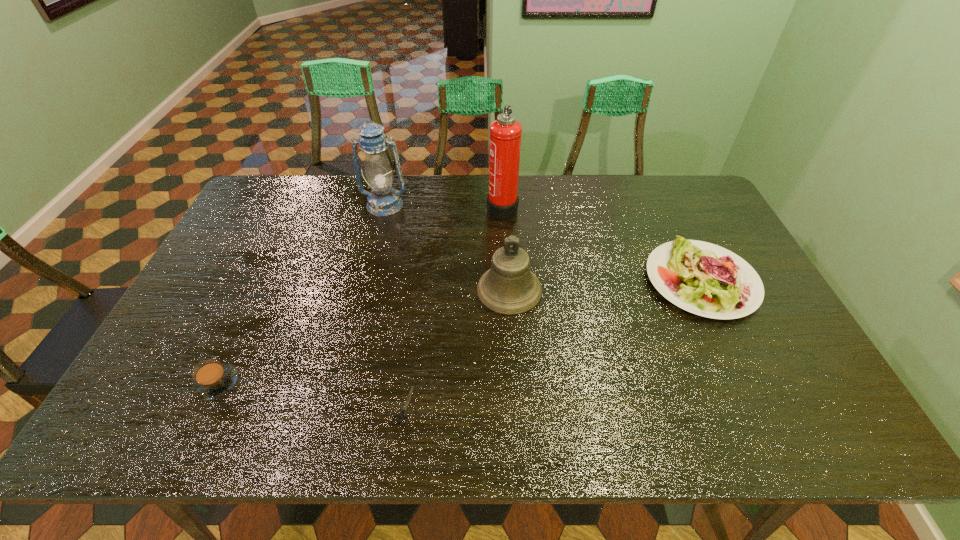
The width and height of the screenshot is (960, 540). In order to click on vacant area situated 0.370m on the front-facing side of the fire extinguisher in this screenshot , I will do `click(378, 206)`.

Identify the location of vacant space located on the front-facing side of the fire extinguisher. This screenshot has width=960, height=540. (396, 206).

This screenshot has height=540, width=960. Find the location of `vacant area situated on the front-facing side of the fire extinguisher`. vacant area situated on the front-facing side of the fire extinguisher is located at coordinates (393, 206).

I want to click on vacant space situated on the front-facing side of the fifth object from right to left, so click(x=362, y=298).

Find the location of a particular element. This screenshot has width=960, height=540. vacant space located 0.150m on the right of the fourth shortest object is located at coordinates (595, 290).

This screenshot has height=540, width=960. I want to click on blank space located on the front of the rightmost object, so click(x=739, y=360).

Locate an element on the screen. free space located on the right of the leftmost object is located at coordinates (357, 383).

Where is `vacant space located on the right of the fourth object from right to left`? This screenshot has height=540, width=960. vacant space located on the right of the fourth object from right to left is located at coordinates (575, 406).

Image resolution: width=960 pixels, height=540 pixels. In order to click on fire extinguisher at the far edge in this screenshot , I will do `click(505, 135)`.

At what (x,y) coordinates should I click in order to perform the action: click on lantern at the far edge. Please return your answer as a coordinate pair (x, y). The height and width of the screenshot is (540, 960). Looking at the image, I should click on (383, 200).